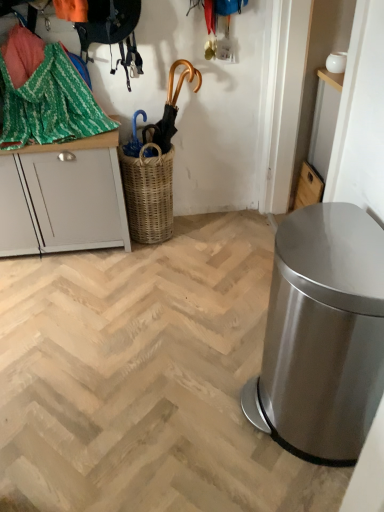
Describe the element at coordinates (170, 108) in the screenshot. I see `gold metallic umbrella at upper center` at that location.

What is the approximate height of wooden cabinet at upper right, the 2th cabinetry in the left-to-right sequence?

It is 12.24 inches.

In order to face wooden cabinet at upper right, the 2th cabinetry in the left-to-right sequence, should I rotate leftwards or rightwards?

It's best to rotate right around 15.176 degrees.

The width and height of the screenshot is (384, 512). What do you see at coordinates (148, 193) in the screenshot?
I see `woven brown basket at center` at bounding box center [148, 193].

In order to face green woven fabric at upper left, should I rotate leftwards or rightwards?

Turn left by 18.076 degrees to look at green woven fabric at upper left.

You are a GUI agent. You are given a task and a screenshot of the screen. Output one action in this format:
    pyautogui.click(x=<x>, y=<y>)
    Task: Click on the white painted wood cabinet at left, which is the 1th cabinetry from left to right
    This screenshot has width=384, height=512.
    Given the screenshot: What is the action you would take?
    [x=63, y=197]

The width and height of the screenshot is (384, 512). I want to click on gold metallic umbrella at upper center, so click(x=170, y=108).

Based on the photo, is woven brown basket at center positioned behind white painted wood cabinet at left, marked as the 2th cabinetry in a right-to-left arrangement?

Yes.

Is point (163, 167) closer to camera compared to point (40, 246)?

Yes, it is.

Could you tell me if woven brown basket at center is facing white painted wood cabinet at left, marked as the 2th cabinetry in a right-to-left arrangement?

No, woven brown basket at center is not turned towards white painted wood cabinet at left, marked as the 2th cabinetry in a right-to-left arrangement.

Does woven brown basket at center touch white painted wood cabinet at left, which is the 1th cabinetry from left to right?

No, woven brown basket at center is not in contact with white painted wood cabinet at left, which is the 1th cabinetry from left to right.

How different are the orientations of satin silver trash can at right and white painted wood cabinet at left, which is the 1th cabinetry from left to right, in degrees?

satin silver trash can at right and white painted wood cabinet at left, which is the 1th cabinetry from left to right, are facing 91.7 degrees away from each other.

Could white painted wood cabinet at left, which is the 1th cabinetry from left to right, be considered to be inside satin silver trash can at right?

No.

From the image's perspective, between satin silver trash can at right and white painted wood cabinet at left, which is the 1th cabinetry from left to right, who is located below?

From the image's view, satin silver trash can at right is below.

Which of these two, satin silver trash can at right or white painted wood cabinet at left, which is the 1th cabinetry from left to right, is thinner?

Thinner between the two is white painted wood cabinet at left, which is the 1th cabinetry from left to right.

Is wooden cabinet at upper right, the 2th cabinetry in the left-to-right sequence, inside the boundaries of satin silver trash can at right, or outside?

wooden cabinet at upper right, the 2th cabinetry in the left-to-right sequence, is located beyond the bounds of satin silver trash can at right.

In terms of height, does wooden cabinet at upper right, the 2th cabinetry in the left-to-right sequence, look taller or shorter compared to satin silver trash can at right?

Considering their sizes, wooden cabinet at upper right, the 2th cabinetry in the left-to-right sequence, has less height than satin silver trash can at right.

Is wooden cabinet at upper right, the 1th cabinetry in the right-to-left sequence, thinner than satin silver trash can at right?

Yes, wooden cabinet at upper right, the 1th cabinetry in the right-to-left sequence, is thinner than satin silver trash can at right.

How distant is gold metallic umbrella at upper center from woven brown basket at center?

9.23 inches.

Relative to woven brown basket at center, is gold metallic umbrella at upper center in front or behind?

gold metallic umbrella at upper center is in front of woven brown basket at center.

Is gold metallic umbrella at upper center located outside woven brown basket at center?

Absolutely, gold metallic umbrella at upper center is external to woven brown basket at center.

Which is farther, (172, 105) or (146, 209)?

Positioned behind is point (146, 209).

Find the location of a particular element. waste container located in front of the woven brown basket at center is located at coordinates (323, 334).

Consider the image. Relative to woven brown basket at center, is satin silver trash can at right in front or behind?

In the image, satin silver trash can at right appears in front of woven brown basket at center.

Is satin silver trash can at right positioned far away from woven brown basket at center?

Indeed, satin silver trash can at right is not near woven brown basket at center.

Between gold metallic umbrella at upper center and satin silver trash can at right, which one has larger size?

Bigger between the two is satin silver trash can at right.

Considering the positions of objects gold metallic umbrella at upper center and satin silver trash can at right in the image provided, who is more to the left, gold metallic umbrella at upper center or satin silver trash can at right?

gold metallic umbrella at upper center is more to the left.

Is gold metallic umbrella at upper center in front of or behind satin silver trash can at right in the image?

gold metallic umbrella at upper center is behind satin silver trash can at right.

Looking at this image, could satin silver trash can at right be considered to be inside gold metallic umbrella at upper center?

That's incorrect, satin silver trash can at right is not inside gold metallic umbrella at upper center.

Measure the distance between woven brown basket at center and wooden cabinet at upper right, the 2th cabinetry in the left-to-right sequence.

A distance of 32.77 inches exists between woven brown basket at center and wooden cabinet at upper right, the 2th cabinetry in the left-to-right sequence.

Considering the relative sizes of woven brown basket at center and wooden cabinet at upper right, the 1th cabinetry in the right-to-left sequence, in the image provided, is woven brown basket at center shorter than wooden cabinet at upper right, the 1th cabinetry in the right-to-left sequence,?

No, woven brown basket at center is not shorter than wooden cabinet at upper right, the 1th cabinetry in the right-to-left sequence.

Which is closer to the camera, (165, 163) or (305, 205)?

The point (165, 163) is closer.

Does woven brown basket at center turn towards wooden cabinet at upper right, the 1th cabinetry in the right-to-left sequence?

No, woven brown basket at center is not facing towards wooden cabinet at upper right, the 1th cabinetry in the right-to-left sequence.

Where is `cabinetry on the left of woven brown basket at center`? The image size is (384, 512). cabinetry on the left of woven brown basket at center is located at coordinates (63, 197).

What are the coordinates of `the 2nd cabinetry above when counting from the satin silver trash can at right (from the image's perspective)` in the screenshot? It's located at (63, 197).

When comparing their distances from woven brown basket at center, does gold metallic umbrella at upper center or white painted wood cabinet at left, marked as the 2th cabinetry in a right-to-left arrangement, seem further?

The object further to woven brown basket at center is gold metallic umbrella at upper center.

Estimate the real-world distances between objects in this image. Which object is closer to wooden cabinet at upper right, the 2th cabinetry in the left-to-right sequence, white painted wood cabinet at left, which is the 1th cabinetry from left to right, or woven brown basket at center?

The object closer to wooden cabinet at upper right, the 2th cabinetry in the left-to-right sequence, is woven brown basket at center.

Based on the photo, when comparing their distances from wooden cabinet at upper right, the 1th cabinetry in the right-to-left sequence, does white painted wood cabinet at left, marked as the 2th cabinetry in a right-to-left arrangement, or green woven fabric at upper left seem further?

Based on the image, green woven fabric at upper left appears to be further to wooden cabinet at upper right, the 1th cabinetry in the right-to-left sequence.

Which object lies nearer to the anchor point wooden cabinet at upper right, the 1th cabinetry in the right-to-left sequence, satin silver trash can at right or gold metallic umbrella at upper center?

gold metallic umbrella at upper center is closer to wooden cabinet at upper right, the 1th cabinetry in the right-to-left sequence.

Considering their positions, is wooden cabinet at upper right, the 1th cabinetry in the right-to-left sequence, positioned closer to satin silver trash can at right than gold metallic umbrella at upper center?

wooden cabinet at upper right, the 1th cabinetry in the right-to-left sequence, is closer to satin silver trash can at right.

From the image, which object appears to be nearer to woven brown basket at center, satin silver trash can at right or white painted wood cabinet at left, marked as the 2th cabinetry in a right-to-left arrangement?

white painted wood cabinet at left, marked as the 2th cabinetry in a right-to-left arrangement, is positioned closer to the anchor woven brown basket at center.

From the image, which object appears to be nearer to white painted wood cabinet at left, which is the 1th cabinetry from left to right, woven brown basket at center or wooden cabinet at upper right, the 2th cabinetry in the left-to-right sequence?

woven brown basket at center is closer to white painted wood cabinet at left, which is the 1th cabinetry from left to right.

Based on their spatial positions, is woven brown basket at center or gold metallic umbrella at upper center further from wooden cabinet at upper right, the 2th cabinetry in the left-to-right sequence?

woven brown basket at center is further to wooden cabinet at upper right, the 2th cabinetry in the left-to-right sequence.

Locate an element on the screen. This screenshot has width=384, height=512. cabinetry between satin silver trash can at right and gold metallic umbrella at upper center in the front-back direction is located at coordinates (63, 197).

What are the coordinates of `umbrella located between white painted wood cabinet at left, which is the 1th cabinetry from left to right, and wooden cabinet at upper right, the 1th cabinetry in the right-to-left sequence, in the left-right direction` in the screenshot? It's located at (170, 108).

I want to click on umbrella between satin silver trash can at right and wooden cabinet at upper right, the 2th cabinetry in the left-to-right sequence, in the front-back direction, so click(x=170, y=108).

Find the location of a particular element. The height and width of the screenshot is (512, 384). laundry between white painted wood cabinet at left, marked as the 2th cabinetry in a right-to-left arrangement, and satin silver trash can at right from left to right is located at coordinates (49, 104).